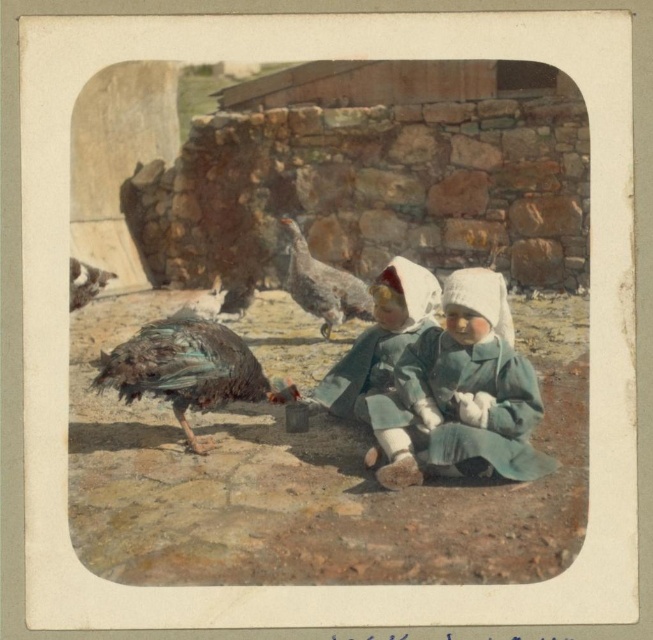
Looking at the scene with the two children feeding birds, you notice the multicolored feathered bird at center and the gray feathered turkey at center. Which bird is positioned to the left side?

The multicolored feathered bird at center is to the left of the gray feathered turkey at center.

You are standing at the center of the scene. There is a point marked at coordinates (187,371). What is located at that point?

The point at (187,371) indicates a multicolored feathered bird at center.